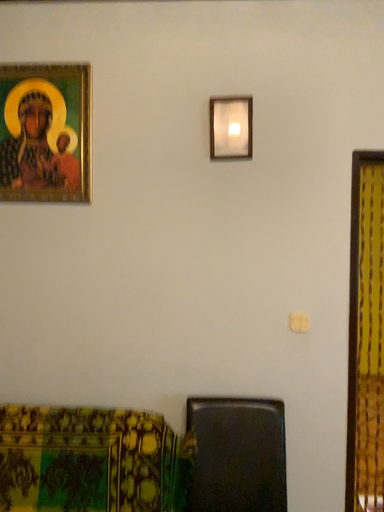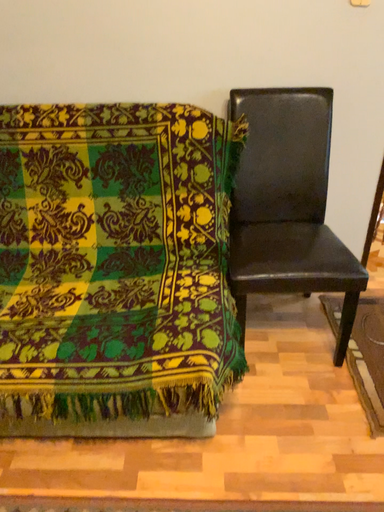
Question: Which way did the camera rotate in the video?

Choices:
 (A) rotated upward
 (B) rotated downward

Answer: (B)